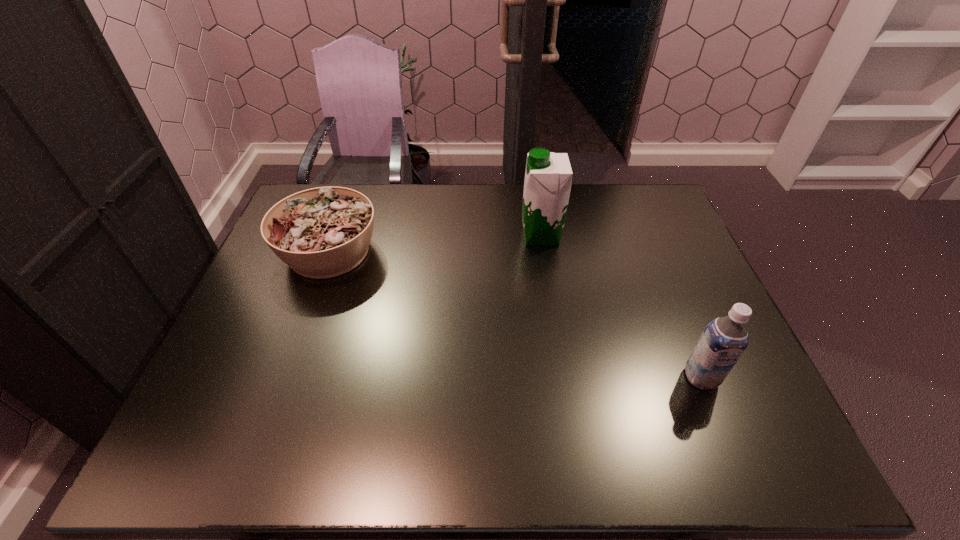
Identify the location of vacant region located 0.230m on the front of the salad. Image resolution: width=960 pixels, height=540 pixels. tap(291, 357).

In order to click on soya milk that is positioned at the far edge in this screenshot , I will do `click(548, 176)`.

Where is `salad that is at the far edge`? This screenshot has height=540, width=960. salad that is at the far edge is located at coordinates (323, 232).

Image resolution: width=960 pixels, height=540 pixels. Find the location of `object that is positioned at the left edge`. object that is positioned at the left edge is located at coordinates (323, 232).

Where is `object at the right edge`? object at the right edge is located at coordinates (724, 339).

This screenshot has width=960, height=540. I want to click on object situated at the far left corner, so click(x=323, y=232).

Locate an element on the screen. vacant space at the far edge is located at coordinates (419, 207).

Locate an element on the screen. vacant space at the near edge of the desktop is located at coordinates (636, 467).

Locate an element on the screen. This screenshot has height=540, width=960. free space at the left edge is located at coordinates (261, 269).

Locate an element on the screen. The height and width of the screenshot is (540, 960). vacant space at the right edge of the desktop is located at coordinates (674, 301).